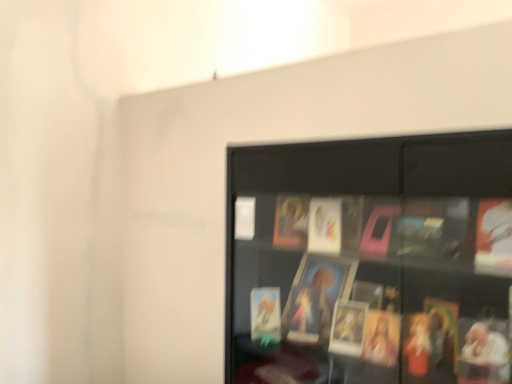
Question: Should I look upward or downward to see black glass shelf at upper right?

Choices:
 (A) up
 (B) down

Answer: (B)